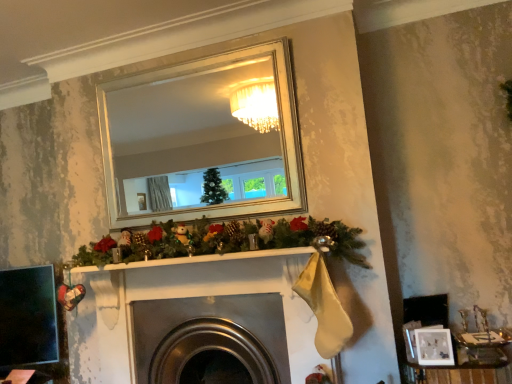
Question: Can you confirm if metallic silver jewelry box at lower right is thinner than metallic silver fireplace at center?

Choices:
 (A) no
 (B) yes

Answer: (B)

Question: Is metallic silver jewelry box at lower right placed right next to metallic silver fireplace at center?

Choices:
 (A) no
 (B) yes

Answer: (A)

Question: Considering the relative sizes of metallic silver jewelry box at lower right and metallic silver fireplace at center in the image provided, is metallic silver jewelry box at lower right smaller than metallic silver fireplace at center?

Choices:
 (A) yes
 (B) no

Answer: (A)

Question: Is metallic silver jewelry box at lower right taller than metallic silver fireplace at center?

Choices:
 (A) no
 (B) yes

Answer: (A)

Question: From a real-world perspective, is metallic silver jewelry box at lower right on top of metallic silver fireplace at center?

Choices:
 (A) no
 (B) yes

Answer: (A)

Question: From the image's perspective, is metallic silver jewelry box at lower right below metallic silver fireplace at center?

Choices:
 (A) yes
 (B) no

Answer: (A)

Question: From a real-world perspective, is metallic silver fireplace at center positioned under metallic silver jewelry box at lower right based on gravity?

Choices:
 (A) no
 (B) yes

Answer: (A)

Question: Can you confirm if metallic silver fireplace at center is shorter than metallic silver jewelry box at lower right?

Choices:
 (A) no
 (B) yes

Answer: (A)

Question: From the image's perspective, is metallic silver fireplace at center beneath metallic silver jewelry box at lower right?

Choices:
 (A) yes
 (B) no

Answer: (B)

Question: Is metallic silver jewelry box at lower right located within metallic silver fireplace at center?

Choices:
 (A) yes
 (B) no

Answer: (B)

Question: Is metallic silver fireplace at center not near metallic silver jewelry box at lower right?

Choices:
 (A) yes
 (B) no

Answer: (B)

Question: Is metallic silver fireplace at center next to metallic silver jewelry box at lower right?

Choices:
 (A) no
 (B) yes

Answer: (A)

Question: Is metallic silver jewelry box at lower right outside white matte picture frame at lower right?

Choices:
 (A) yes
 (B) no

Answer: (A)